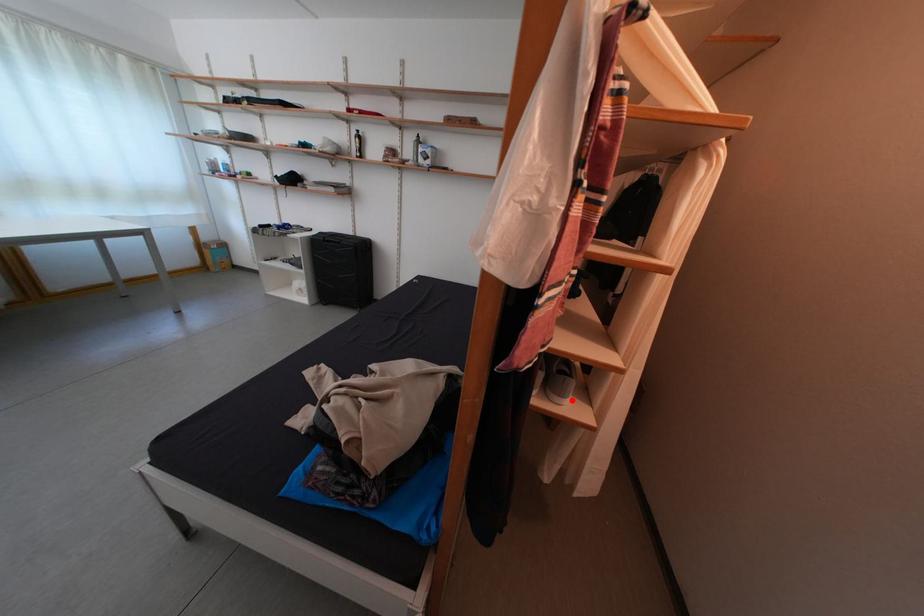
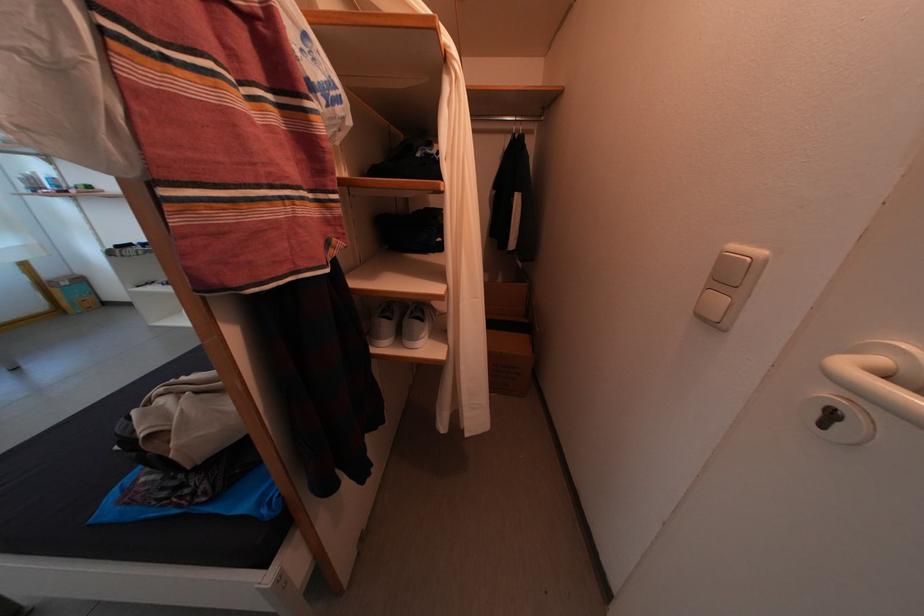
Where in the second image is the point corresponding to the highlighted location from the first image?

(423, 344)